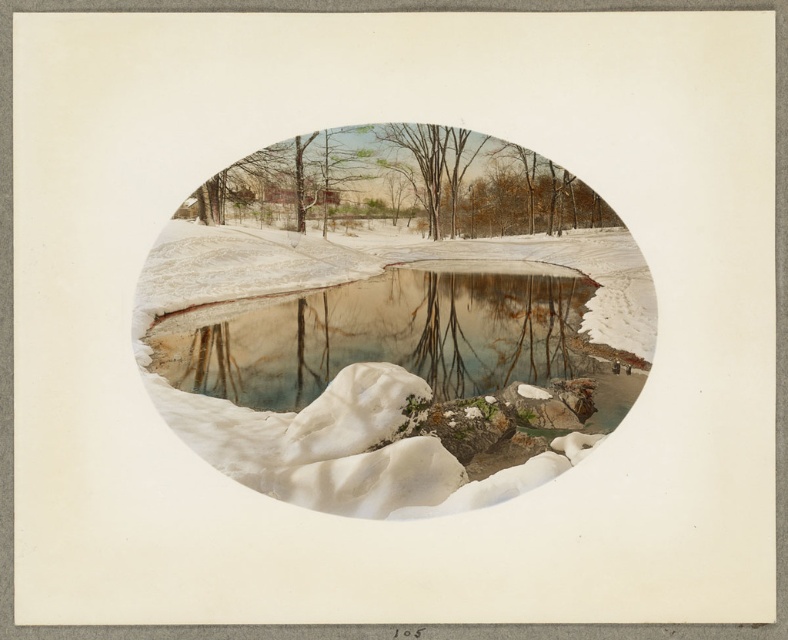
You are standing in the snowy landscape of the winter scene. You see two points marked in the image. Which point, point (340, 480) or point (385, 141), is closer to you?

Point (340, 480) is closer to the viewer than point (385, 141).

You are an artist looking at the winter scene within the oval frame. You notice two trees at the center. Which tree is closer to you, the smooth brown tree at center or the brown matte tree at center?

The smooth brown tree at center is closer to you because it is positioned in front of the brown matte tree at center.

You are an artist trying to paint the winter scene shown in the image. You need to decide the order to paint the white snow at center and the smooth brown tree at center. According to the scene, which object should you paint first to ensure proper layering?

The smooth brown tree at center should be painted first because the white snow at center is located below it, meaning the tree appears in front of the snow in the scene.